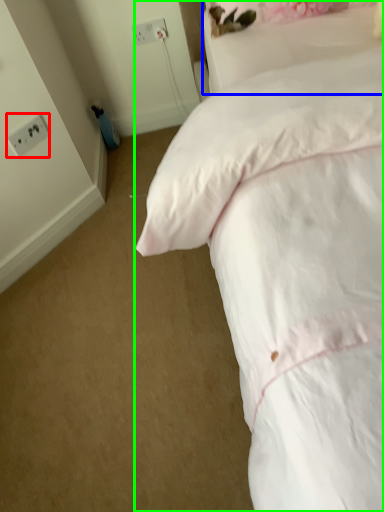
Question: Which object is the farthest from electric outlet (highlighted by a red box)? Choose among these: pillow (highlighted by a blue box) or bed (highlighted by a green box).

Choices:
 (A) pillow
 (B) bed

Answer: (B)